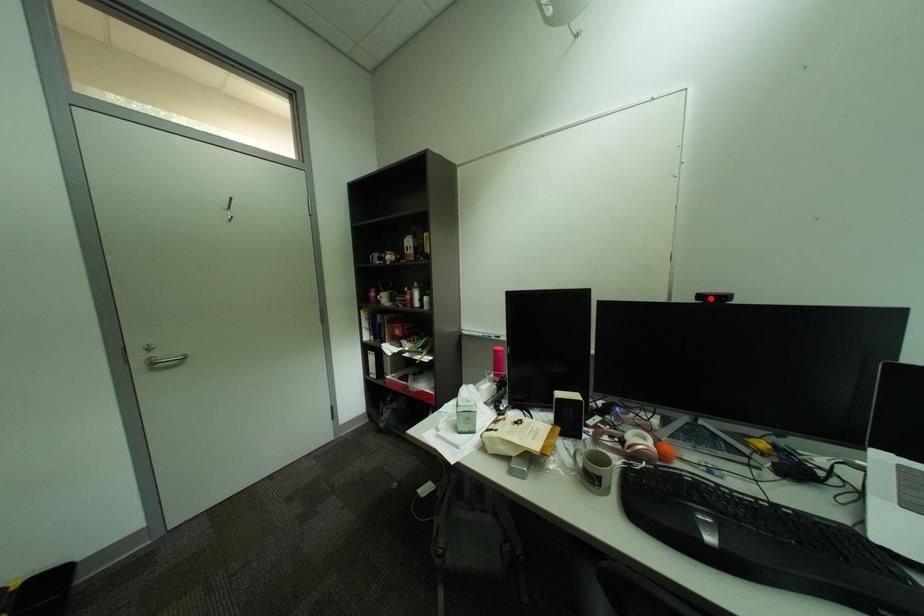
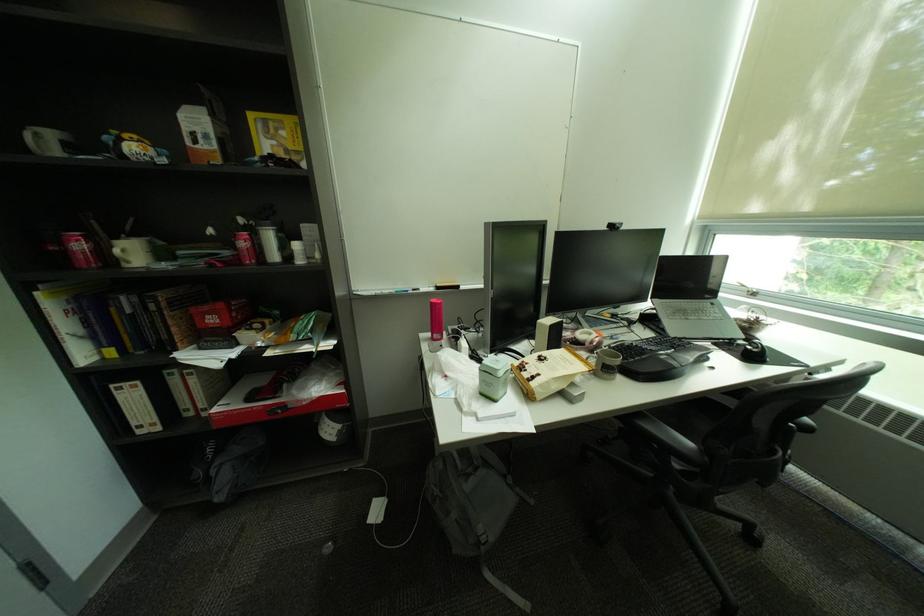
Locate, in the second image, the point that corresponds to the highlighted location in the first image.

(621, 227)